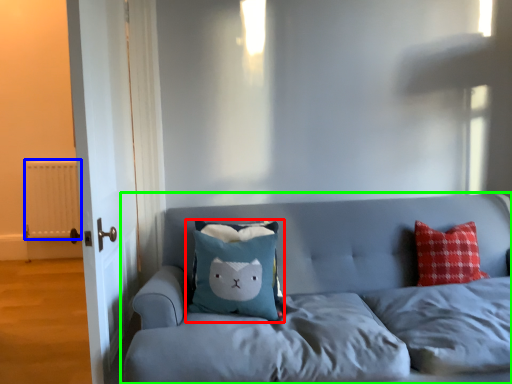
Question: Considering the real-world distances, which object is closest to pillow (highlighted by a red box)? radiator (highlighted by a blue box) or studio couch (highlighted by a green box).

Choices:
 (A) radiator
 (B) studio couch

Answer: (B)